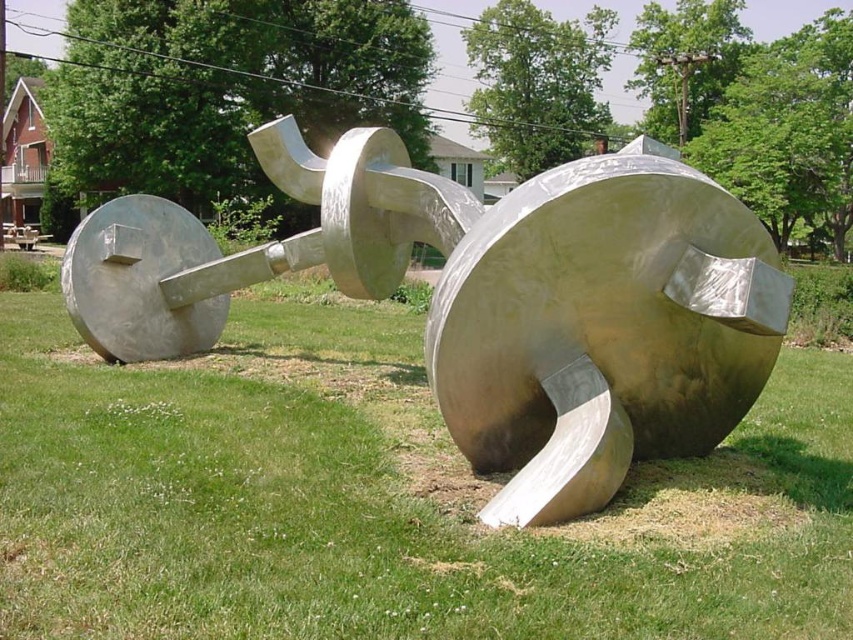
Question: Does green grass at center appear over polished silver sculpture at center?

Choices:
 (A) yes
 (B) no

Answer: (B)

Question: Among these objects, which one is farthest from the camera?

Choices:
 (A) green grass at center
 (B) polished silver sculpture at center

Answer: (B)

Question: Is green grass at center smaller than polished silver sculpture at center?

Choices:
 (A) yes
 (B) no

Answer: (B)

Question: Which point is closer to the camera taking this photo?

Choices:
 (A) (x=791, y=356)
 (B) (x=581, y=337)

Answer: (B)

Question: Observing the image, what is the correct spatial positioning of green grass at center in reference to polished silver sculpture at center?

Choices:
 (A) above
 (B) below

Answer: (B)

Question: Among these objects, which one is nearest to the camera?

Choices:
 (A) polished silver sculpture at center
 (B) green grass at center

Answer: (B)